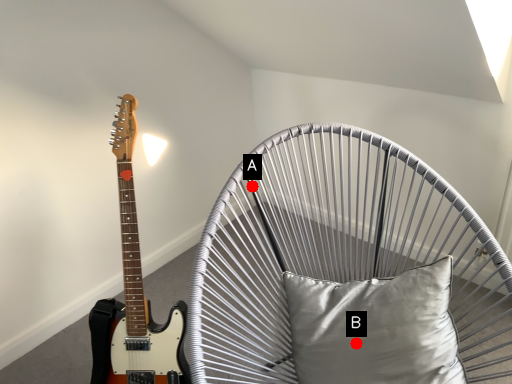
Question: Two points are circled on the image, labeled by A and B beside each circle. Which point appears farthest from the camera in this image?

Choices:
 (A) A is further
 (B) B is further

Answer: (A)